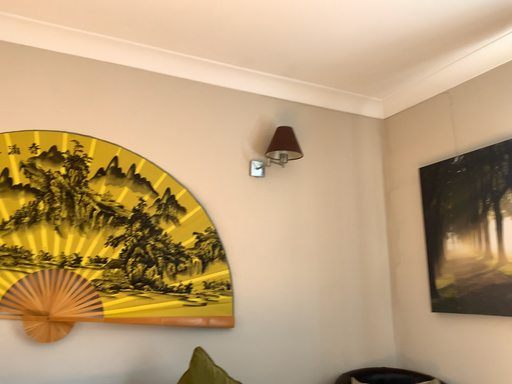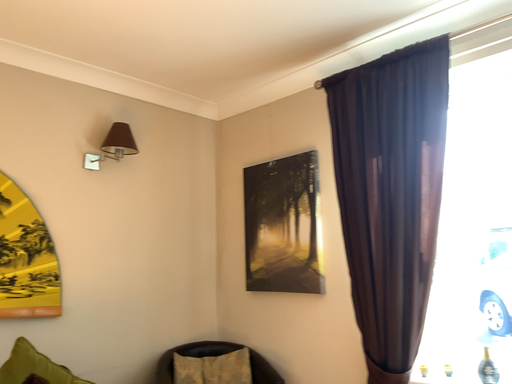
Question: Which way did the camera rotate in the video?

Choices:
 (A) rotated left
 (B) rotated right

Answer: (B)